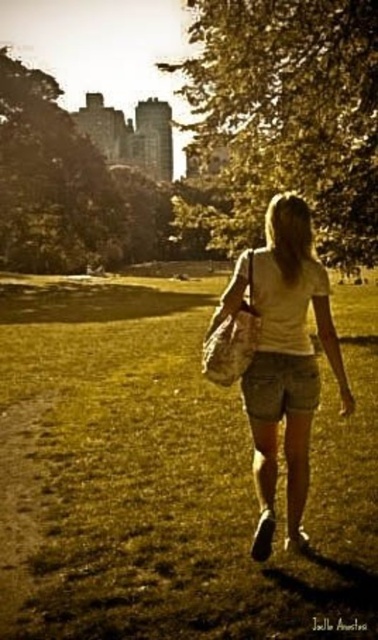
You are a hiker planning to take a photo of the green leafy tree at upper center and the brown dirt path at lower left. Which object in the scene is wider?

The green leafy tree at upper center is wider than the brown dirt path at lower left.